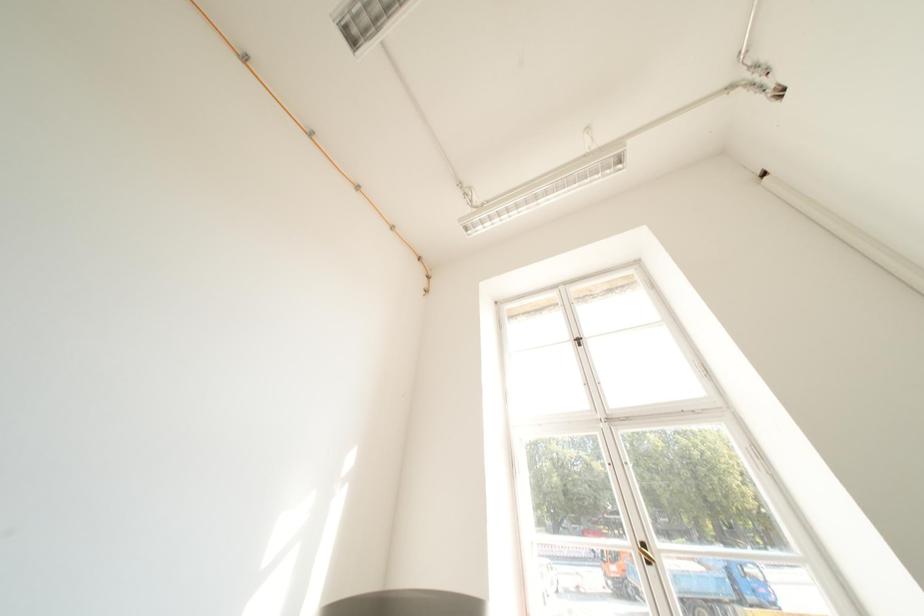
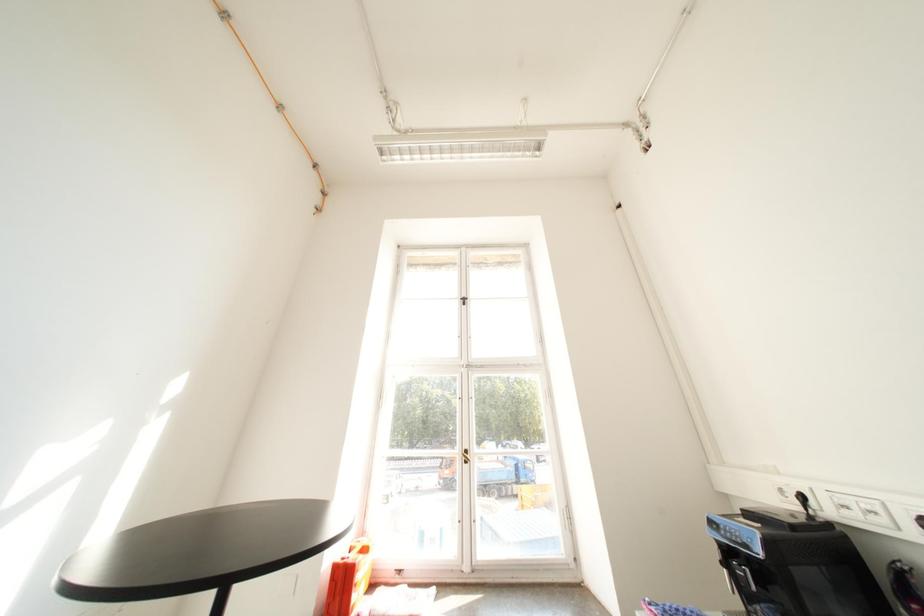
Question: Based on the continuous images, in which direction is the camera rotating? Reply with the corresponding letter.

Choices:
 (A) Left
 (B) Right
 (C) Up
 (D) Down

Answer: (B)